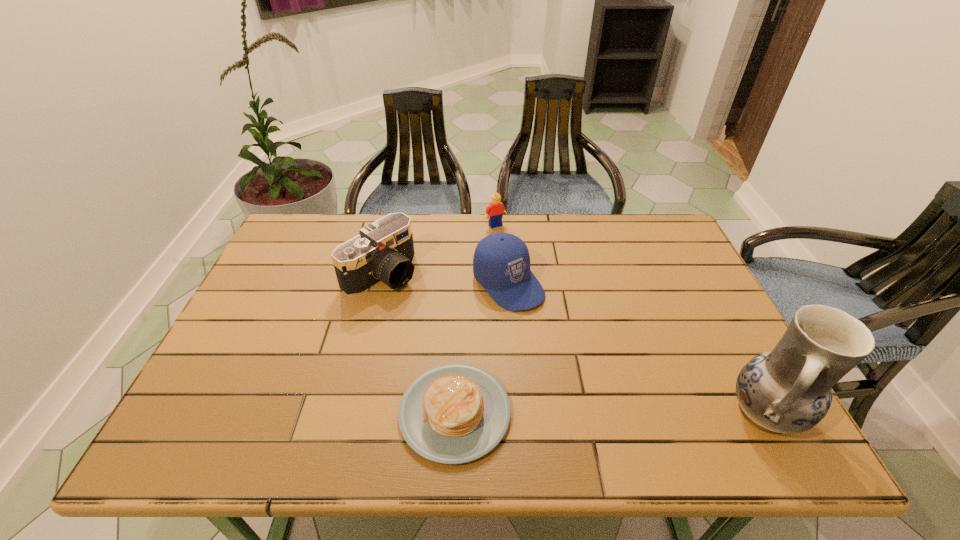
Where is `free space on the desktop that is between the pancake and the rightmost object and is positioned on the front-facing side of the camera`? free space on the desktop that is between the pancake and the rightmost object and is positioned on the front-facing side of the camera is located at coordinates [x=577, y=413].

Identify the location of free space on the desktop that is between the shortest object and the tallest object and is positioned on the front-facing side of the cap. (640, 414).

Identify the location of vacant space on the desktop that is between the shortest object and the rightmost object and is positioned on the face of the Lego. Image resolution: width=960 pixels, height=540 pixels. (639, 414).